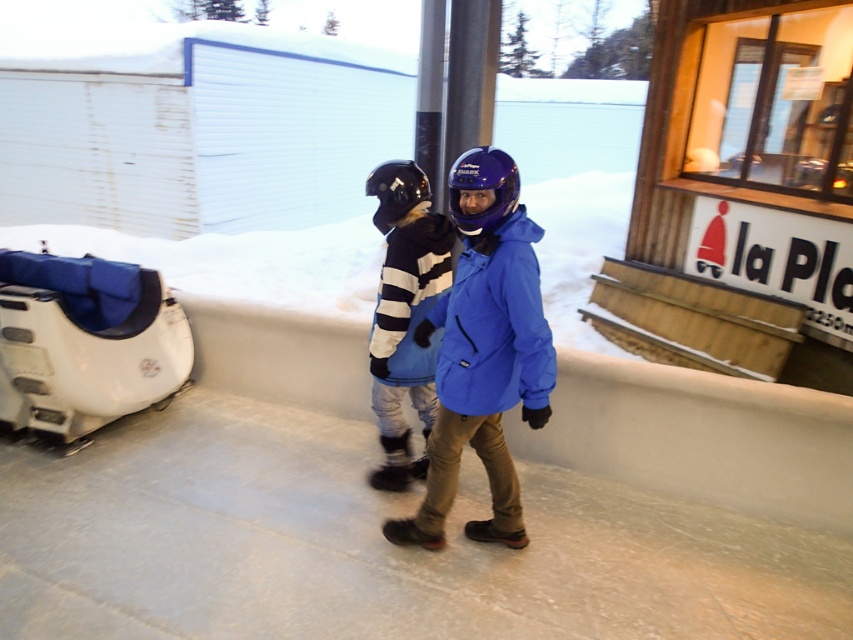
You are planning to take a photo of the striped fleece jacket at center but there is a blue fabric snowmobile at lower left blocking the view. Can you move the snowmobile to get a clear shot?

The blue fabric snowmobile at lower left is positioned over striped fleece jacket at center, so moving it would allow you to see the striped fleece jacket at center clearly.

From the picture: You are planning to take a photo of the blue fabric snowmobile at lower left and the striped fleece jacket at center. Which object should be placed closer to the camera to ensure both are in focus if the camera has a limited depth of field?

The blue fabric snowmobile at lower left should be placed closer to the camera because it is shorter than the striped fleece jacket at center, allowing both to be in focus with the camera having limited depth of field.